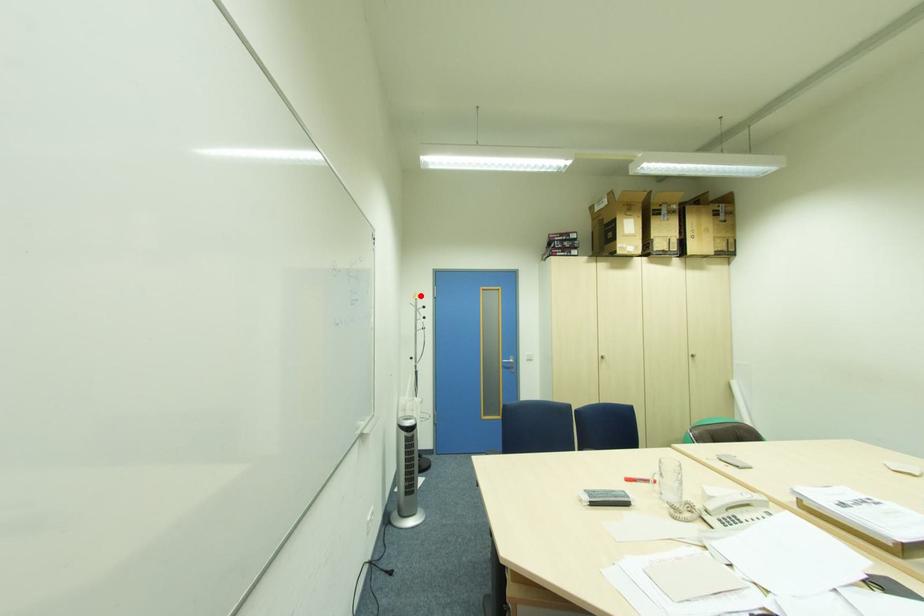
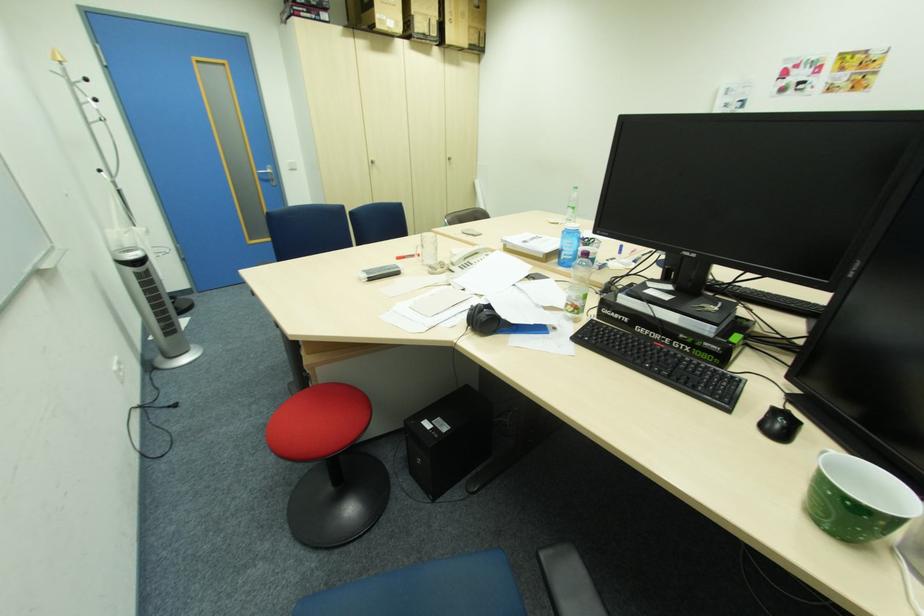
In the second image, find the point that corresponds to the highlighted location in the first image.

(62, 55)